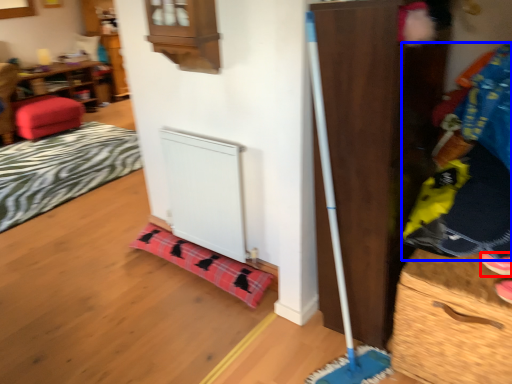
Question: Which of the following is the farthest to the observer, shoe (highlighted by a red box) or clothing (highlighted by a blue box)?

Choices:
 (A) shoe
 (B) clothing

Answer: (A)